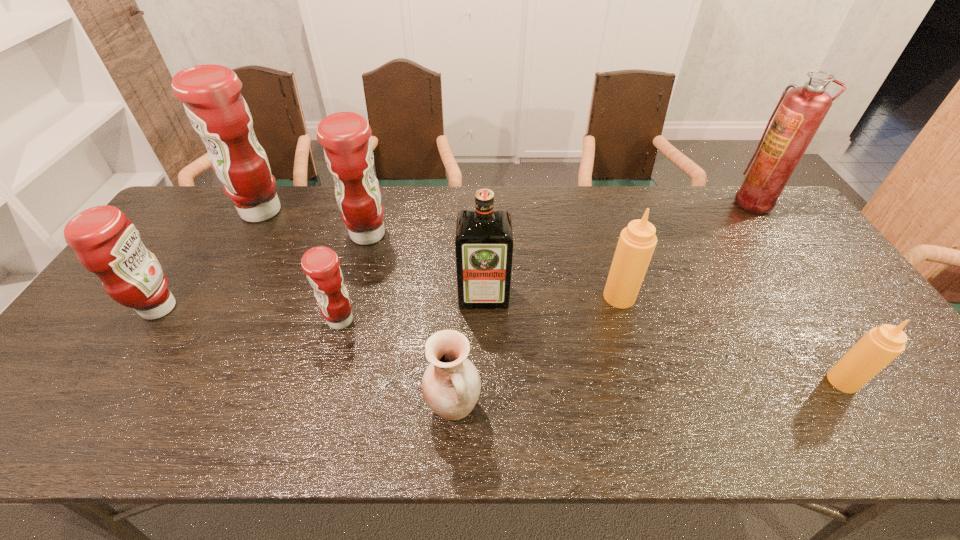
Where is `free space between the pottery and the third biggest red condiment`? Image resolution: width=960 pixels, height=540 pixels. free space between the pottery and the third biggest red condiment is located at coordinates [x=306, y=357].

Locate which object is the third closest to the biggest red condiment. Please provide its 2D coordinates. Your answer should be formatted as a tuple, i.e. [(x, y)], where the tuple contains the x and y coordinates of a point satisfying the conditions above.

[(320, 264)]

Identify which object is the sixth closest to the farther tan condiment. Please provide its 2D coordinates. Your answer should be formatted as a tuple, i.e. [(x, y)], where the tuple contains the x and y coordinates of a point satisfying the conditions above.

[(320, 264)]

Locate which condiment is the closest to the fire extinguisher. Please provide its 2D coordinates. Your answer should be formatted as a tuple, i.e. [(x, y)], where the tuple contains the x and y coordinates of a point satisfying the conditions above.

[(636, 244)]

Identify the location of condiment object that ranks as the closest to the smallest red condiment. (348, 152).

Where is `red condiment that stands as the third closest to the fire extinguisher`? red condiment that stands as the third closest to the fire extinguisher is located at coordinates (211, 94).

Locate which red condiment is the fourth closest to the liquor. Please provide its 2D coordinates. Your answer should be formatted as a tuple, i.e. [(x, y)], where the tuple contains the x and y coordinates of a point satisfying the conditions above.

[(106, 243)]

Identify the location of free location that satisfies the following two spatial constraints: 1. on the front side of the pottery; 2. on the left side of the smallest red condiment. (317, 407).

The width and height of the screenshot is (960, 540). What are the coordinates of `vacant position in the image that satisfies the following two spatial constraints: 1. on the side of the fire extinguisher with the label; 2. on the front label of the liquor` in the screenshot? It's located at (820, 295).

You are a GUI agent. You are given a task and a screenshot of the screen. Output one action in this format:
    pyautogui.click(x=<x>, y=<y>)
    Task: Click on the vacant space that satisfies the following two spatial constraints: 1. on the front label of the rightmost condiment; 2. on the right side of the liquor
    The height and width of the screenshot is (540, 960).
    Given the screenshot: What is the action you would take?
    pyautogui.click(x=484, y=381)